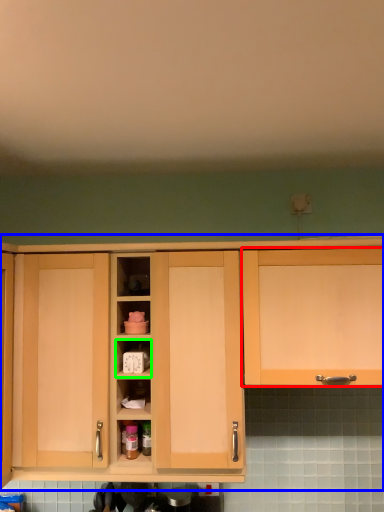
Question: Which object is the closest to the cabinetry (highlighted by a red box)? Choose among these: cabinetry (highlighted by a blue box) or cabinet (highlighted by a green box).

Choices:
 (A) cabinetry
 (B) cabinet

Answer: (A)